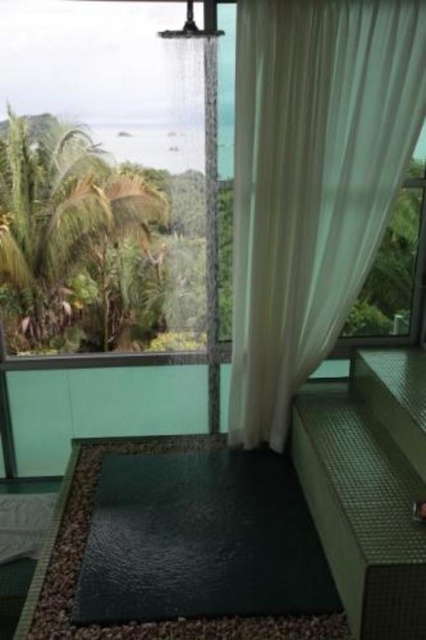
Is white sheer curtain at upper center positioned behind transparent glass window at upper left?

No, white sheer curtain at upper center is closer to the viewer.

Who is lower down, white sheer curtain at upper center or transparent glass window at upper left?

white sheer curtain at upper center is lower down.

Which is behind, point (282, 237) or point (69, 321)?

The point (69, 321) is more distant.

This screenshot has width=426, height=640. Find the location of `white sheer curtain at upper center`. white sheer curtain at upper center is located at coordinates (311, 182).